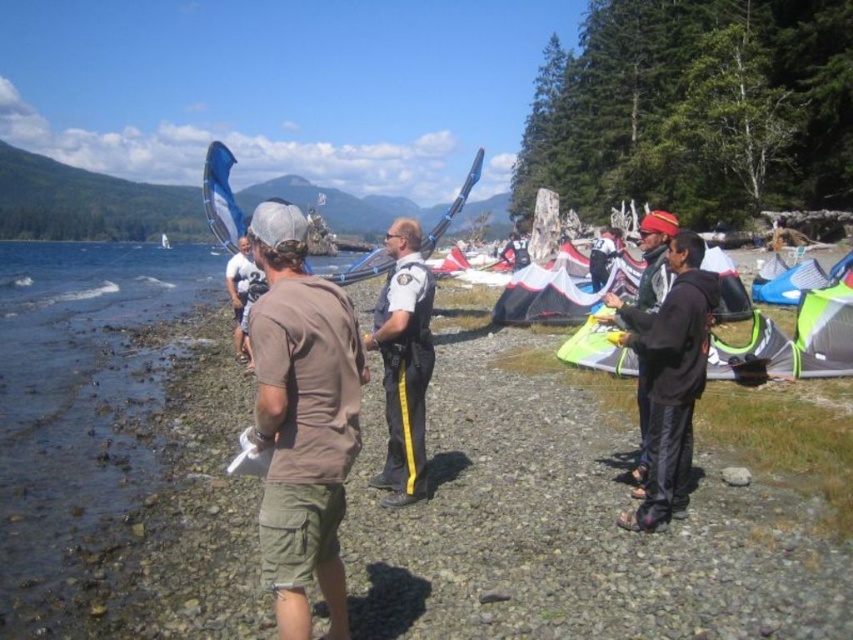
You are a photographer positioned at the camera location. You want to take a photo that includes both the point at coordinates point[339,584] and point[780,280]. Which point will appear larger in your photo?

Point[339,584] will appear larger in the photo because it is closer to the camera than point[780,280].